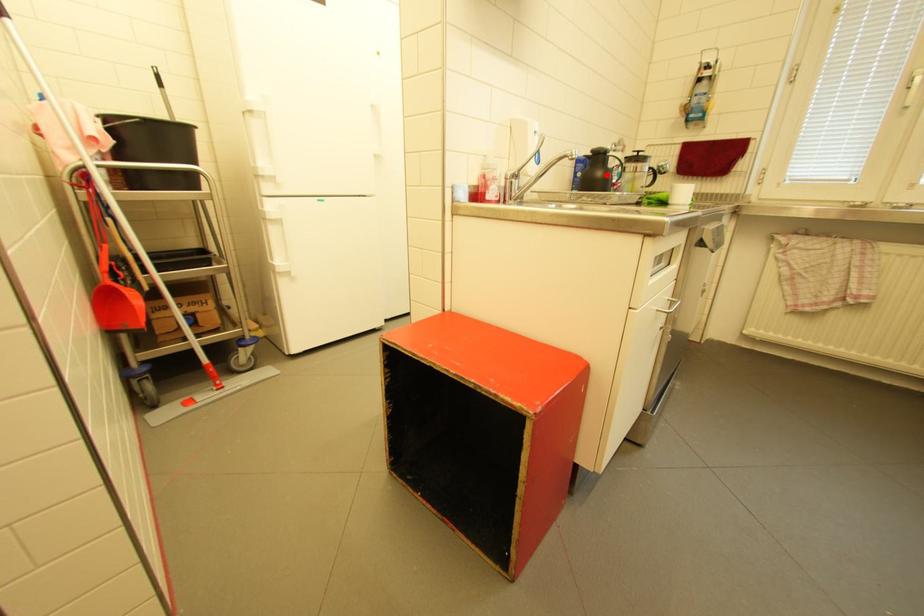
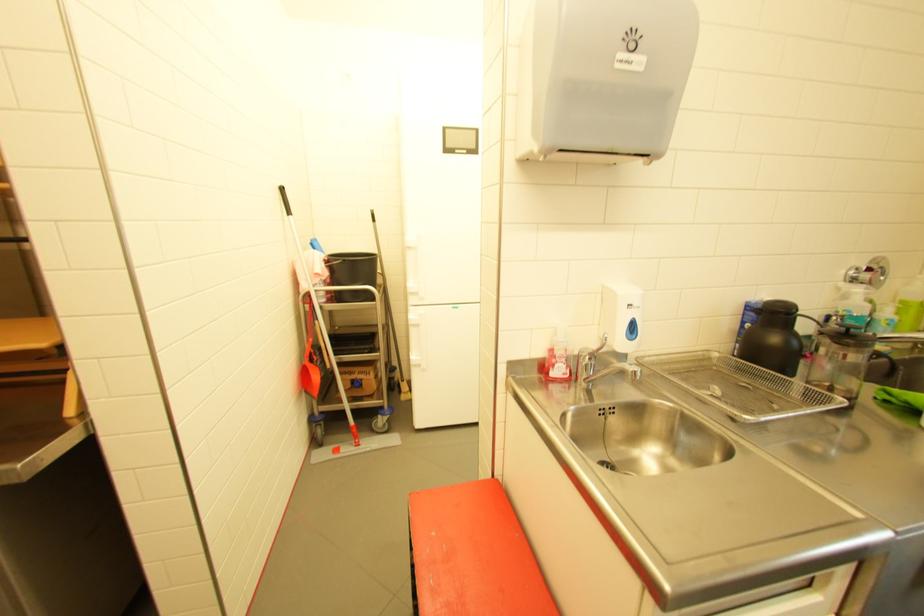
In the second image, find the point that corresponds to the highlighted location in the first image.

(782, 339)